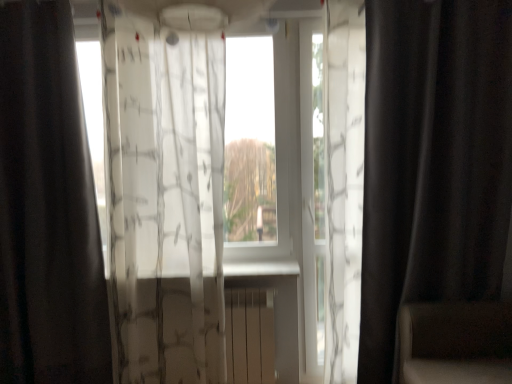
Question: Relative to translucent white curtain at center, positioned as the second curtain in left-to-right order, is black matte curtain at left, which appears as the third curtain when viewed from the right, in front or behind?

Choices:
 (A) behind
 (B) front

Answer: (A)

Question: From the image's perspective, is black matte curtain at left, which appears as the third curtain when viewed from the right, positioned above or below translucent white curtain at center, positioned as the second curtain in left-to-right order?

Choices:
 (A) above
 (B) below

Answer: (A)

Question: Which of these objects is positioned closest to the black matte curtain at left, which appears as the third curtain when viewed from the right?

Choices:
 (A) white plastic radiator at center
 (B) black matte curtain at right, the 1th curtain from the right
 (C) translucent white curtain at center, the second curtain in the right-to-left sequence
 (D) dark brown leather armchair at right
 (E) transparent fabric at center

Answer: (C)

Question: Estimate the real-world distances between objects in this image. Which object is closer to the black matte curtain at right, which is the third curtain in left-to-right order?

Choices:
 (A) black matte curtain at left, which is the 1th curtain in left-to-right order
 (B) dark brown leather armchair at right
 (C) matte beige radiator at center
 (D) translucent white curtain at center, positioned as the second curtain in left-to-right order
 (E) white plastic radiator at center

Answer: (B)